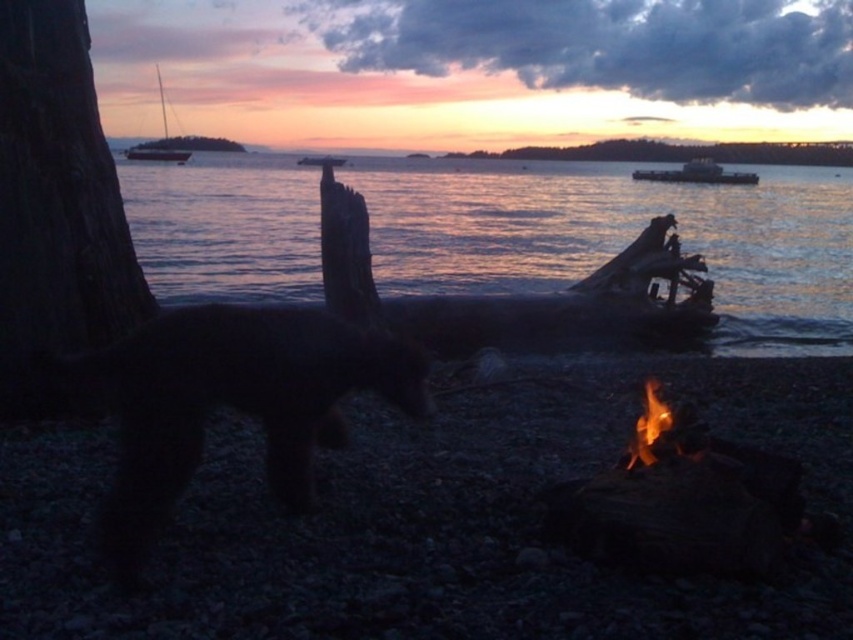
You are an artist trying to sketch this lakeside scene. You want to ensure the charcoal gray pebbles at lower right and the smooth bark log at upper center are proportionally accurate. Which object should you draw with a smaller width?

The charcoal gray pebbles at lower right should be drawn with a smaller width than the smooth bark log at upper center because the charcoal gray pebbles at lower right is thinner than smooth bark log at upper center.

You are standing at the campfire and want to reach the charcoal gray pebbles marked by point (430, 518). Which direction should you walk to get there?

The point (430, 518) is at the lower right, so you should walk towards the lower right direction from the campfire to reach the charcoal gray pebbles.

You are standing at the campfire and want to reach the point marked as point at lower center. Which direction should you move to first? The point at lower center is located at coordinates point [556,209]. The other point is point [15,216]. Please consider the spatial relationship between these two points to determine the correct path.

The point at lower center is located at coordinates point [556,209]. The other point is point [15,216]. Please consider the spatial relationship between these two points to determine the correct path.